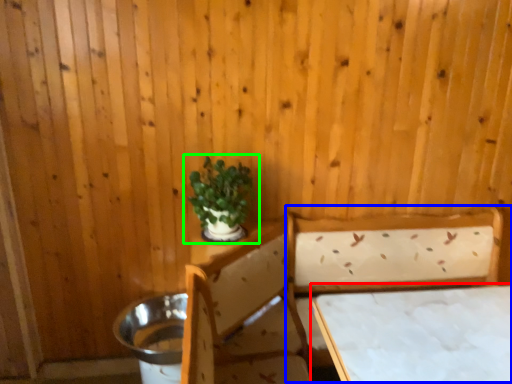
Question: Estimate the real-world distances between objects in this image. Which object is farther from table (highlighted by a red box), bed (highlighted by a blue box) or houseplant (highlighted by a green box)?

Choices:
 (A) bed
 (B) houseplant

Answer: (B)